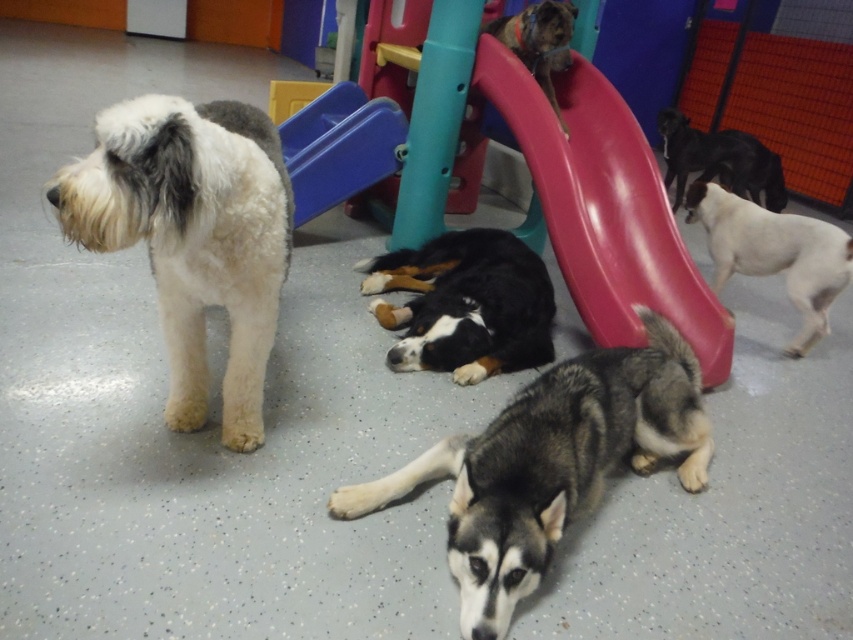
Question: Which of the following is the closest to the observer?

Choices:
 (A) white fluffy dog at left
 (B) gray fur dog at lower center
 (C) white fur dog at right

Answer: (A)

Question: Which point is closer to the camera?

Choices:
 (A) gray fur dog at lower center
 (B) smooth plastic slide at center
 (C) white fur dog at right
 (D) blue plastic slide at upper center

Answer: (A)

Question: Is white fluffy dog at left smaller than black fur at center?

Choices:
 (A) no
 (B) yes

Answer: (B)

Question: Estimate the real-world distances between objects in this image. Which object is closer to the white fur dog at right?

Choices:
 (A) blue plastic slide at upper center
 (B) gray fur dog at lower center
 (C) white fluffy dog at left
 (D) brown fur dog at upper center

Answer: (D)

Question: Considering the relative positions of blue plastic slide at upper center and black glossy dog at upper right in the image provided, where is blue plastic slide at upper center located with respect to black glossy dog at upper right?

Choices:
 (A) left
 (B) right

Answer: (A)

Question: In this image, where is blue plastic slide at upper center located relative to black glossy dog at upper right?

Choices:
 (A) left
 (B) right

Answer: (A)